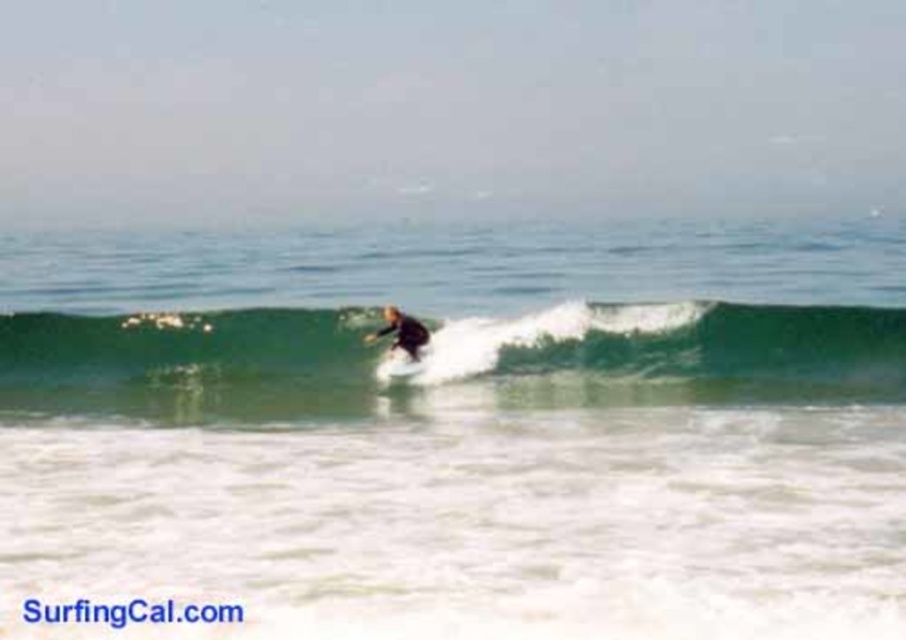
Can you confirm if green rubber wave at center is positioned below white foam surfboard at center?

Indeed, green rubber wave at center is positioned under white foam surfboard at center.

Who is more distant from viewer, (302, 371) or (405, 353)?

The point (405, 353) is behind.

This screenshot has height=640, width=906. Identify the location of green rubber wave at center. (686, 355).

Does black wetsuit surfer at center have a greater width compared to white foam surfboard at center?

Yes, black wetsuit surfer at center is wider than white foam surfboard at center.

Between black wetsuit surfer at center and white foam surfboard at center, which one is positioned lower?

white foam surfboard at center is below.

Does point (372, 332) lie behind point (386, 365)?

Yes, it is behind point (386, 365).

Find the location of a particular element. The width and height of the screenshot is (906, 640). black wetsuit surfer at center is located at coordinates (401, 332).

Does green rubber wave at center appear under black wetsuit surfer at center?

Yes.

Who is more distant from viewer, [213,412] or [371,336]?

The point [371,336] is more distant.

Identify the location of green rubber wave at center. This screenshot has width=906, height=640. (686, 355).